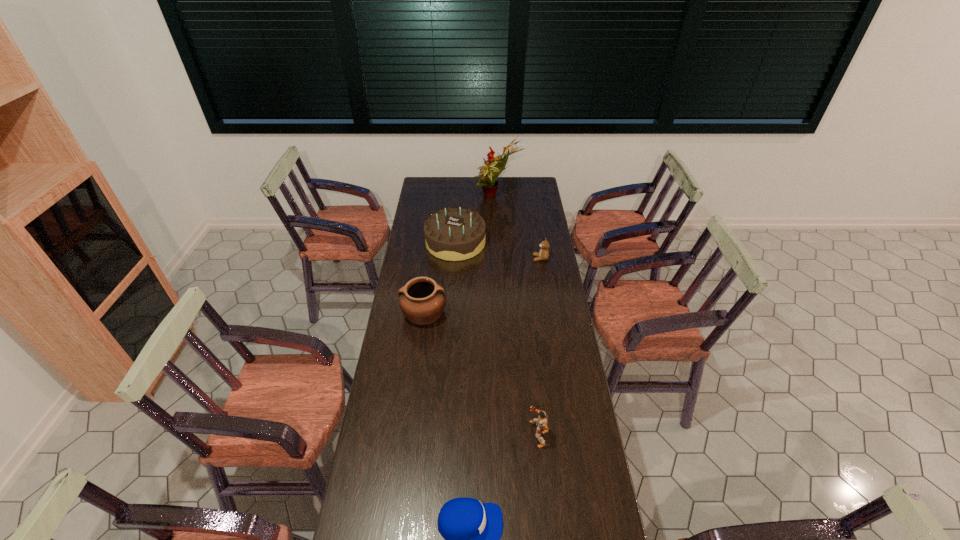
In order to click on vacant region between the tallest object and the rightmost object in this screenshot , I will do `click(518, 228)`.

Find the location of a particular element. The height and width of the screenshot is (540, 960). unoccupied position between the second nearest object and the third nearest object is located at coordinates (481, 374).

Where is `vacant area that lies between the puncher and the birthday cake`? This screenshot has height=540, width=960. vacant area that lies between the puncher and the birthday cake is located at coordinates (496, 338).

What are the coordinates of `vacant area that lies between the second nearest object and the pottery` in the screenshot? It's located at (481, 374).

Locate which object is the closest to the rightmost object. Please provide its 2D coordinates. Your answer should be formatted as a tuple, i.e. [(x, y)], where the tuple contains the x and y coordinates of a point satisfying the conditions above.

[(454, 234)]

Select which object is the third closest to the second shortest object. Please provide its 2D coordinates. Your answer should be formatted as a tuple, i.e. [(x, y)], where the tuple contains the x and y coordinates of a point satisfying the conditions above.

[(422, 300)]

Identify the location of free spot that satisfies the following two spatial constraints: 1. on the front-facing side of the tallest object; 2. on the front-facing side of the birthday cake. (499, 242).

What are the coordinates of `vacant area in the image that satisfies the following two spatial constraints: 1. on the front-facing side of the tallest object; 2. on the front-facing side of the birthday cake` in the screenshot? It's located at (499, 242).

Locate an element on the screen. This screenshot has width=960, height=540. free space that satisfies the following two spatial constraints: 1. on the front-facing side of the tallest object; 2. on the front-facing side of the birthday cake is located at coordinates (499, 242).

Where is `free space that satisfies the following two spatial constraints: 1. on the front-facing side of the farthest object; 2. on the front-facing side of the birthday cake`? free space that satisfies the following two spatial constraints: 1. on the front-facing side of the farthest object; 2. on the front-facing side of the birthday cake is located at coordinates pyautogui.click(x=499, y=242).